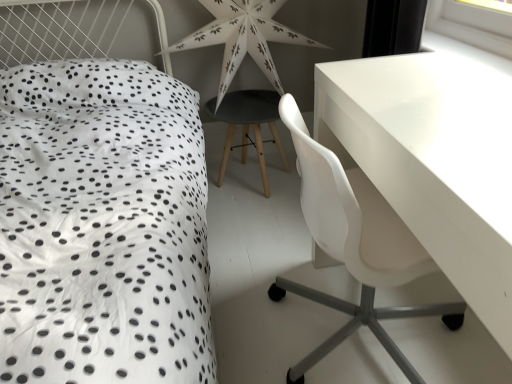
Identify the location of white plastic chair at right. point(355,245).

In order to face white paper star at center, should I rotate leftwards or rightwards?

You should rotate left by 1.402 degrees.

Find the location of a particular element. The height and width of the screenshot is (384, 512). white paper star at center is located at coordinates (243, 38).

I want to click on matte black stool at center, so click(248, 125).

Where is `white plastic chair at right`? The width and height of the screenshot is (512, 384). white plastic chair at right is located at coordinates (355, 245).

You are a GUI agent. You are given a task and a screenshot of the screen. Output one action in this format:
    pyautogui.click(x=<x>, y=<y>)
    Task: Click on the bar stool beneath the white plastic chair at right (from a real-world perspective)
    The height and width of the screenshot is (384, 512).
    Given the screenshot: What is the action you would take?
    pyautogui.click(x=248, y=125)

Can you confirm if matte black stool at center is shorter than white plastic chair at right?

Indeed, matte black stool at center has a lesser height compared to white plastic chair at right.

Could white plastic chair at right be considered to be inside matte black stool at center?

That's incorrect, white plastic chair at right is not inside matte black stool at center.

Is white paper star at center oriented towards matte black stool at center?

No, white paper star at center is not facing towards matte black stool at center.

From the image's perspective, is white paper star at center located above or below matte black stool at center?

From the image's perspective, white paper star at center appears above matte black stool at center.

Does white paper star at center have a greater width compared to matte black stool at center?

No.

Which of these two, white paper star at center or matte black stool at center, is smaller?

With smaller size is matte black stool at center.

From a real-world perspective, which is physically below, white plastic chair at right or matte black stool at center?

matte black stool at center, from a real-world perspective.

Visually, is white plastic chair at right positioned to the left or to the right of matte black stool at center?

Clearly, white plastic chair at right is on the right of matte black stool at center in the image.

Is white plastic chair at right positioned with its back to matte black stool at center?

white plastic chair at right does not have its back to matte black stool at center.

Does white plastic chair at right have a lesser width compared to matte black stool at center?

No.

Can white paper star at center be found inside matte black stool at center?

No, white paper star at center is located outside of matte black stool at center.

Is point (239, 120) closer to viewer compared to point (193, 38)?

No, (239, 120) is behind (193, 38).

Which object is further away from the camera, matte black stool at center or white paper star at center?

matte black stool at center is further from the camera.

Between matte black stool at center and white paper star at center, which one appears on the right side from the viewer's perspective?

white paper star at center.

Is white plastic chair at right beside white paper star at center?

No, white plastic chair at right is not touching white paper star at center.

Is white paper star at center inside white plastic chair at right?

No, white paper star at center is not inside white plastic chair at right.

Does point (349, 243) come in front of point (251, 43)?

That is True.

In the image, is white plastic chair at right on the left side or the right side of white paper star at center?

From the image, it's evident that white plastic chair at right is to the right of white paper star at center.

Is white paper star at center in front of or behind white plastic chair at right in the image?

In the image, white paper star at center appears behind white plastic chair at right.

Identify the location of chair on the right of white paper star at center. (355, 245).

In the scene shown: Considering the relative sizes of white paper star at center and white plastic chair at right in the image provided, is white paper star at center bigger than white plastic chair at right?

Actually, white paper star at center might be smaller than white plastic chair at right.

Where is `bar stool above the white plastic chair at right (from the image's perspective)`? The image size is (512, 384). bar stool above the white plastic chair at right (from the image's perspective) is located at coordinates (248, 125).

Identify the location of star on the right of matte black stool at center. Image resolution: width=512 pixels, height=384 pixels. (243, 38).

Consider the image. Based on their spatial positions, is white paper star at center or matte black stool at center closer to white plastic chair at right?

Based on the image, matte black stool at center appears to be nearer to white plastic chair at right.

Considering their positions, is white plastic chair at right positioned closer to white paper star at center than matte black stool at center?

matte black stool at center lies closer to white paper star at center than the other object.

From the image, which object appears to be farther from white paper star at center, matte black stool at center or white plastic chair at right?

The object further to white paper star at center is white plastic chair at right.

Based on their spatial positions, is white paper star at center or white plastic chair at right further from matte black stool at center?

Among the two, white plastic chair at right is located further to matte black stool at center.

When comparing their distances from matte black stool at center, does white plastic chair at right or white paper star at center seem further?

white plastic chair at right lies further to matte black stool at center than the other object.

Looking at this image, based on their spatial positions, is matte black stool at center or white paper star at center closer to white plastic chair at right?

Based on the image, matte black stool at center appears to be nearer to white plastic chair at right.

The image size is (512, 384). What are the coordinates of `star between white plastic chair at right and matte black stool at center along the z-axis` in the screenshot? It's located at (243, 38).